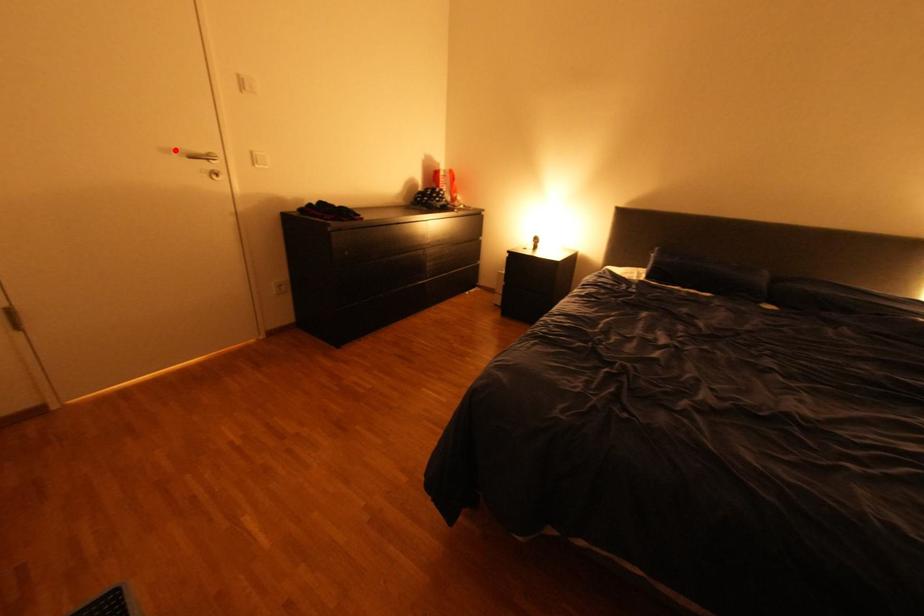
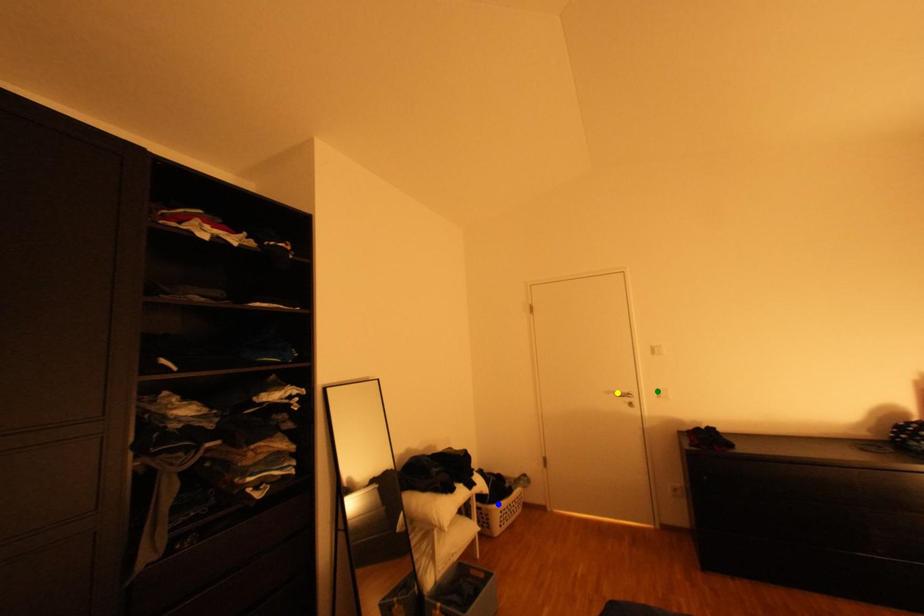
Question: I am providing you with two images of the same scene from different viewpoints. A red point is marked on the first image. You are given multiple points on the second image. Which point in image 2 is actually the same real-world point as the red point in image 1?

Choices:
 (A) green point
 (B) blue point
 (C) yellow point

Answer: (C)